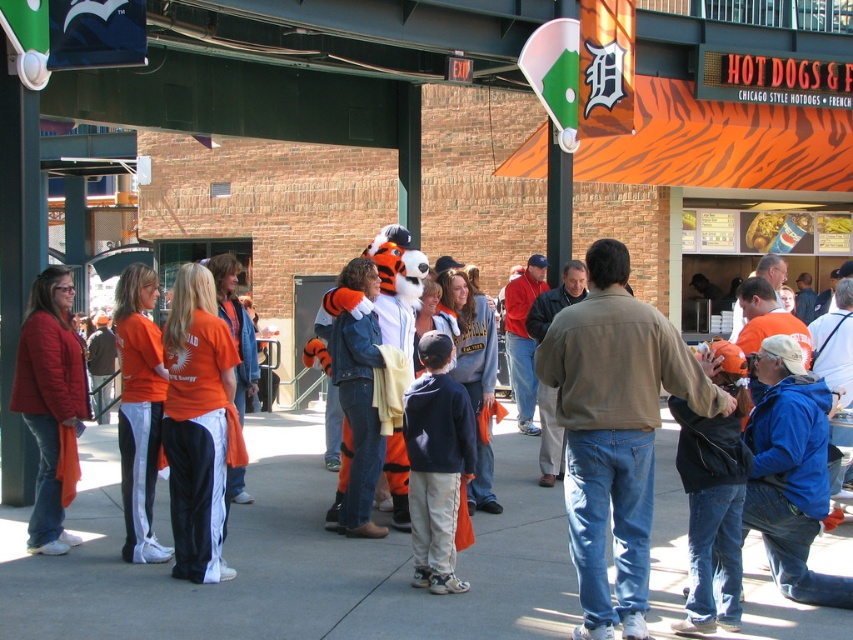
Between black leather jacket at center and orange fabric pants at center, which one is positioned higher?

orange fabric pants at center is higher up.

You are a GUI agent. You are given a task and a screenshot of the screen. Output one action in this format:
    pyautogui.click(x=<x>, y=<y>)
    Task: Click on the black leather jacket at center
    This screenshot has width=853, height=640.
    Given the screenshot: What is the action you would take?
    pyautogui.click(x=712, y=493)

Who is higher up, orange fabric shirt at center or black leather jacket at center?

Positioned higher is orange fabric shirt at center.

Which is in front, point (230, 346) or point (730, 513)?

Point (730, 513) is in front.

Identify the location of orange fabric shirt at center. (199, 426).

Who is shorter, concrete sidewalk at center or brown leather jacket at center?

With less height is concrete sidewalk at center.

Between concrete sidewalk at center and brown leather jacket at center, which one appears on the right side from the viewer's perspective?

brown leather jacket at center

The height and width of the screenshot is (640, 853). Describe the element at coordinates (294, 561) in the screenshot. I see `concrete sidewalk at center` at that location.

Locate an element on the screen. concrete sidewalk at center is located at coordinates (294, 561).